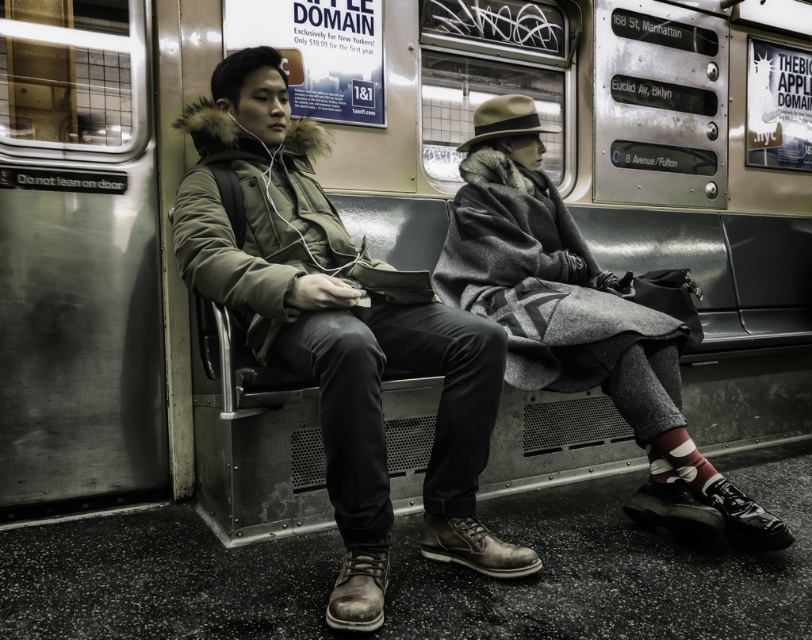
You are a fashion designer observing two coats in a subway scene. The coats are the matte green coat at center and the gray wool coat at center. Which coat is taller?

The matte green coat at center is taller than the gray wool coat at center.

You are a fashion designer observing two coats in a subway scene. The coats are the matte green coat at center and the gray wool coat at center. You need to determine if they can be displayed side by side in a store window without overlapping. The store window requires at least 30 centimeters of space between items. Can they be placed this way?

The matte green coat at center is 57.61 centimeters from gray wool coat at center, which exceeds the required 30 centimeters of space. Therefore, they can be displayed side by side without overlapping.